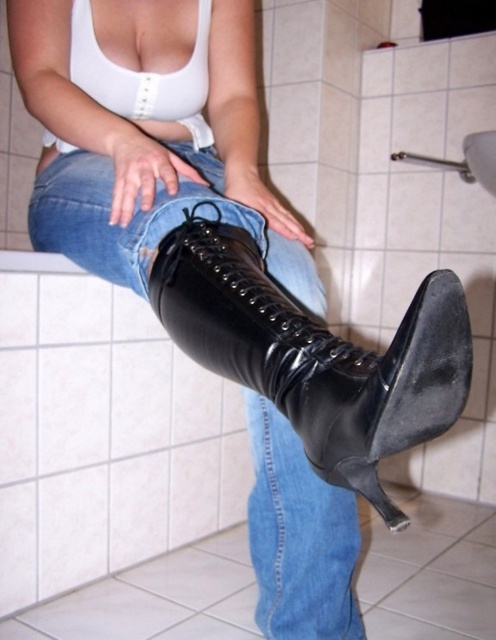
Is black patent leather boot at center above jeans at center?

Yes, black patent leather boot at center is above jeans at center.

Does black patent leather boot at center have a larger size compared to jeans at center?

Actually, black patent leather boot at center might be smaller than jeans at center.

What are the coordinates of `black patent leather boot at center` in the screenshot? It's located at (315, 355).

Locate an element on the screen. This screenshot has height=640, width=496. black patent leather boot at center is located at coordinates (315, 355).